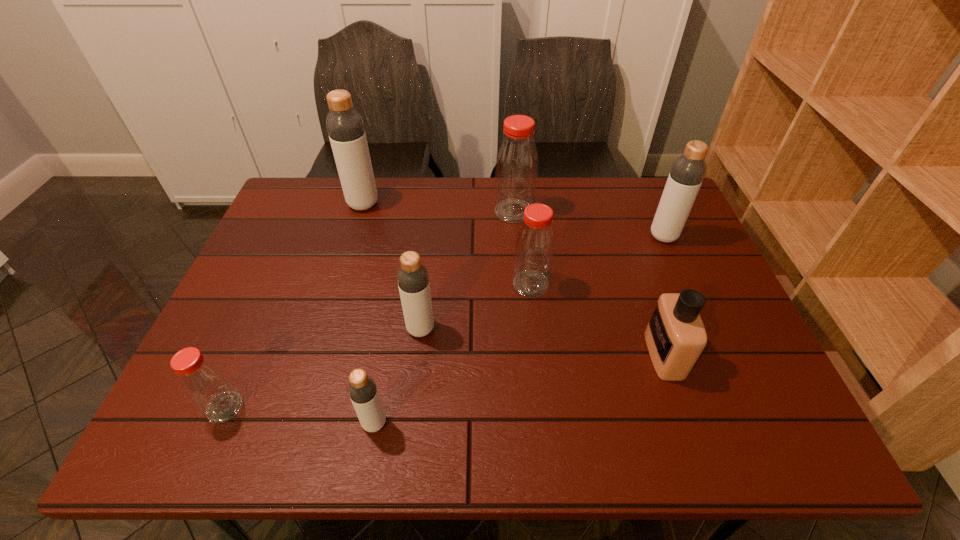
At what (x,y) coordinates should I click in order to perform the action: click on free region located 0.100m on the front label of the perfume. Please return your answer as a coordinate pair (x, y). Looking at the image, I should click on (606, 354).

At what (x,y) coordinates should I click in order to perform the action: click on vacant space located 0.160m on the front label of the perfume. Please return your answer as a coordinate pair (x, y). Looking at the image, I should click on (579, 354).

This screenshot has width=960, height=540. I want to click on vacant space located on the front label of the perfume, so click(531, 354).

The width and height of the screenshot is (960, 540). I want to click on vacant space located 0.180m on the left of the third object from left to right, so click(x=274, y=423).

Identify the location of vacant space located on the back of the leftmost red bottle. (272, 300).

Locate an element on the screen. The width and height of the screenshot is (960, 540). object that is at the left edge is located at coordinates (203, 381).

Image resolution: width=960 pixels, height=540 pixels. In order to click on object present at the right edge in this screenshot , I will do `click(685, 178)`.

The height and width of the screenshot is (540, 960). I want to click on object positioned at the near left corner, so click(x=203, y=381).

Where is `vacant area at the far edge of the desktop`? The width and height of the screenshot is (960, 540). vacant area at the far edge of the desktop is located at coordinates (608, 221).

The height and width of the screenshot is (540, 960). I want to click on free space at the near edge, so click(261, 426).